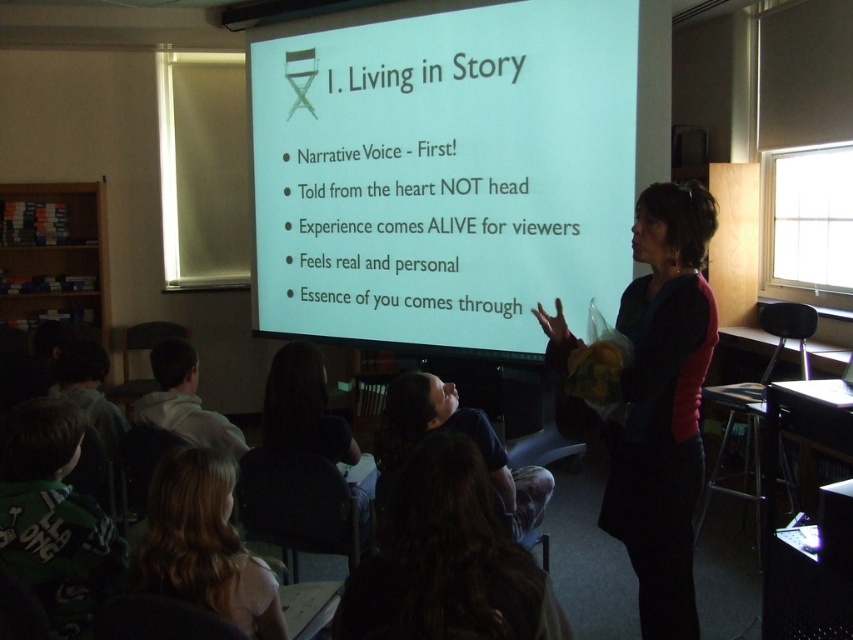
You are a photographer in a classroom where a presentation is happening. You need to capture a photo of the two students with dark hair at lower center and blonde hair at lower left. Since the students are sitting side by side, which student has a wider head? The answer must be based on their hair width as seen in the image.

The dark hair at lower center has a wider head because its width surpasses that of the blonde hair at lower left.

You are a student sitting in the classroom and want to take a photo of the white matte projection screen at center and the dark brown hair at lower center with your phone. Your phone can only focus on objects within 8 feet. Can you take a photo of both objects clearly?

The white matte projection screen at center is 8.11 feet away from dark brown hair at lower center. Since the distance between them is more than 8 feet, your phone cannot focus on both objects clearly at the same time.

You are a student sitting in the classroom and notice two people with dark brown hair at lower center and dark hair at lower center. Which of these two has hair that is shorter?

The dark brown hair at lower center is shorter than dark hair at lower center.